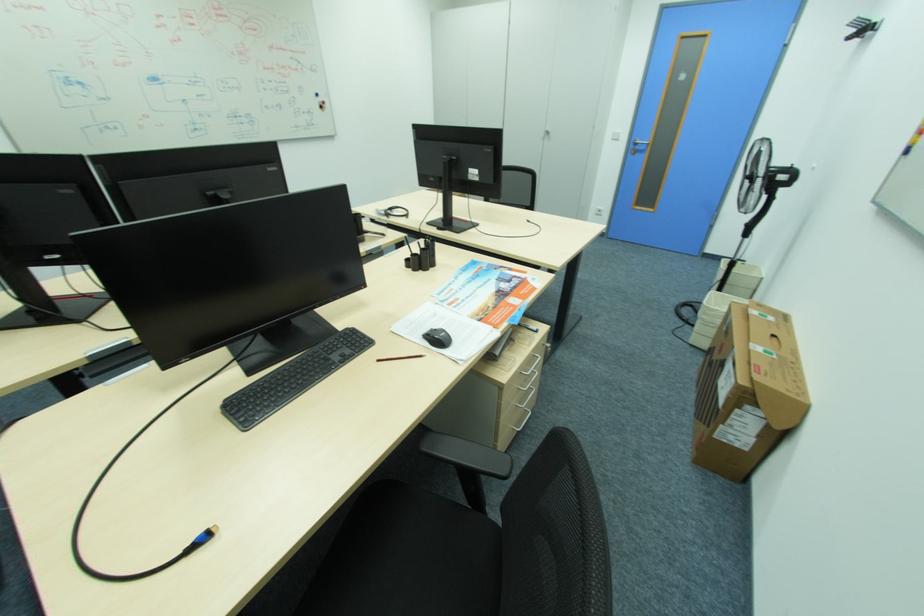
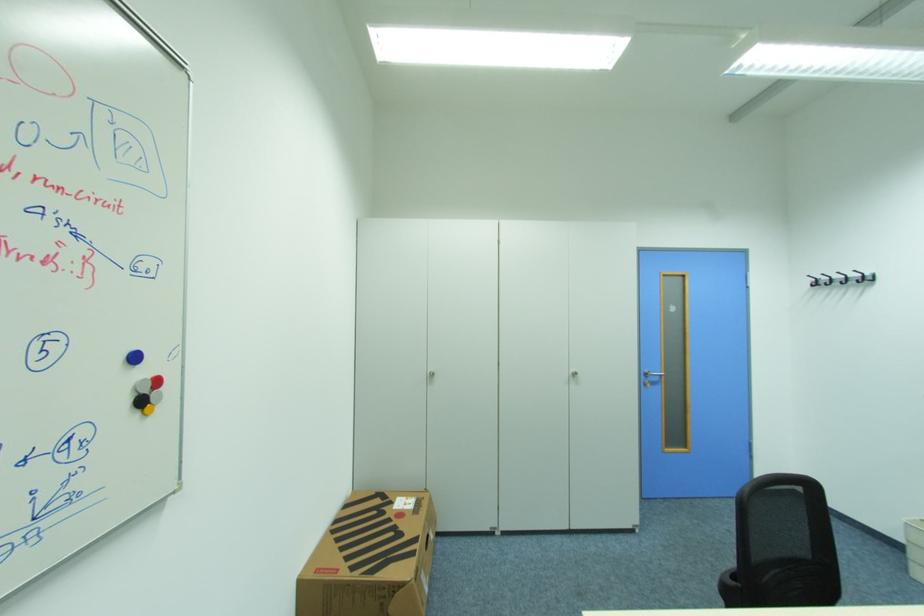
In the second image, find the point that corresponds to point (327, 108) in the first image.

(146, 403)